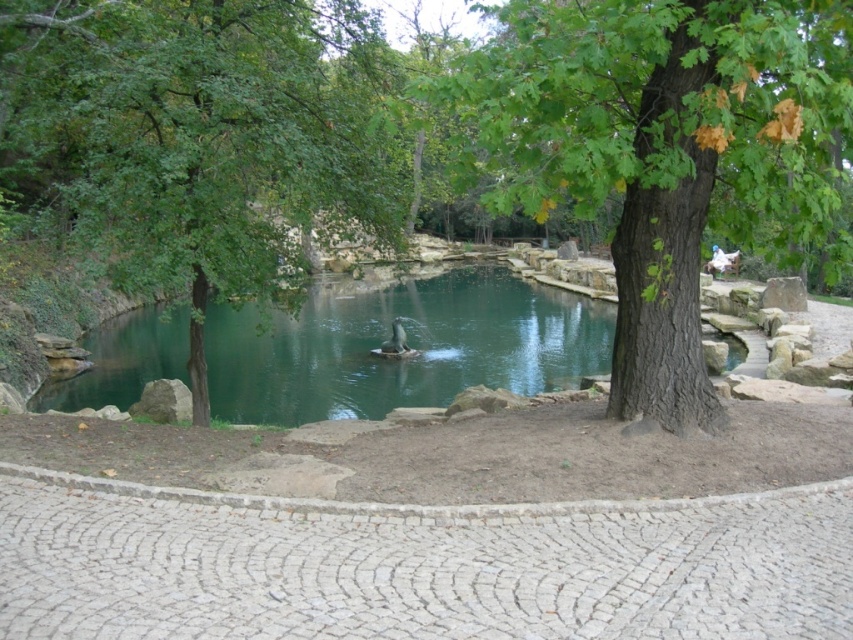
You are standing at the edge of the pond and notice a point marked at coordinates (660, 148). What object is located at that point?

The point at (660, 148) indicates a green rough bark tree at center.

You are standing on the cobblestone path around the pond and see both the green leafy tree at center and the brown fuzzy duck at center. Which one is positioned to the left of the other?

The green leafy tree at center is to the left of the brown fuzzy duck at center.

You are standing at the edge of the pond and want to walk to both the green leafy tree at center and the green rough bark tree at center. Which tree will you reach first if you walk straight ahead along the paved pathway?

Since the green leafy tree at center and green rough bark tree at center are both located at center, you will reach both trees at the same time if you walk straight ahead along the paved pathway.